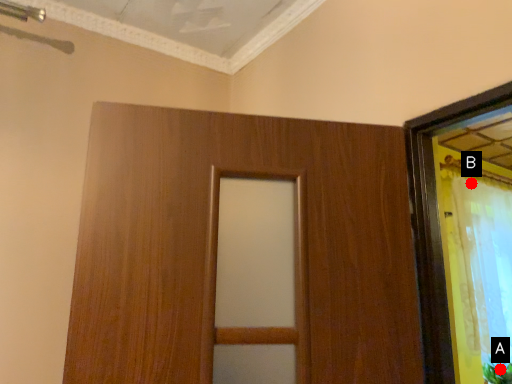
Question: Two points are circled on the image, labeled by A and B beside each circle. Among these points, which one is farthest from the camera?

Choices:
 (A) A is further
 (B) B is further

Answer: (B)